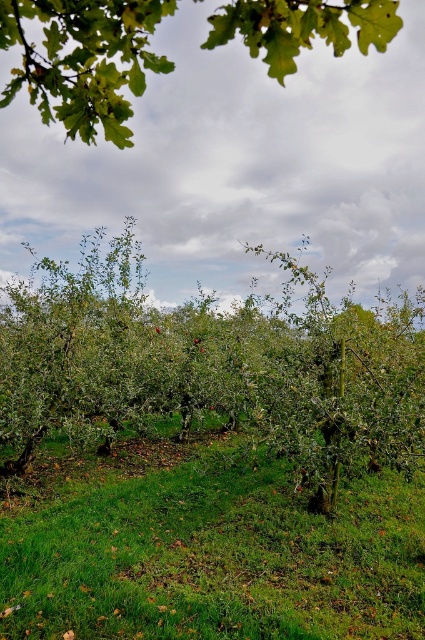
Question: Is green grassy at center in front of green leafy tree at center?

Choices:
 (A) yes
 (B) no

Answer: (A)

Question: Which point is closer to the camera?

Choices:
 (A) green grassy at center
 (B) green leafy branch at upper center

Answer: (B)

Question: Which of these objects is positioned farthest from the green leafy branch at upper center?

Choices:
 (A) green leafy tree at center
 (B) green grassy at center

Answer: (A)

Question: Which object is farther from the camera taking this photo?

Choices:
 (A) green leafy tree at center
 (B) green grassy at center

Answer: (A)

Question: Does green grassy at center appear on the left side of green leafy branch at upper center?

Choices:
 (A) no
 (B) yes

Answer: (A)

Question: Where is green leafy tree at center located in relation to green leafy branch at upper center in the image?

Choices:
 (A) below
 (B) above

Answer: (A)